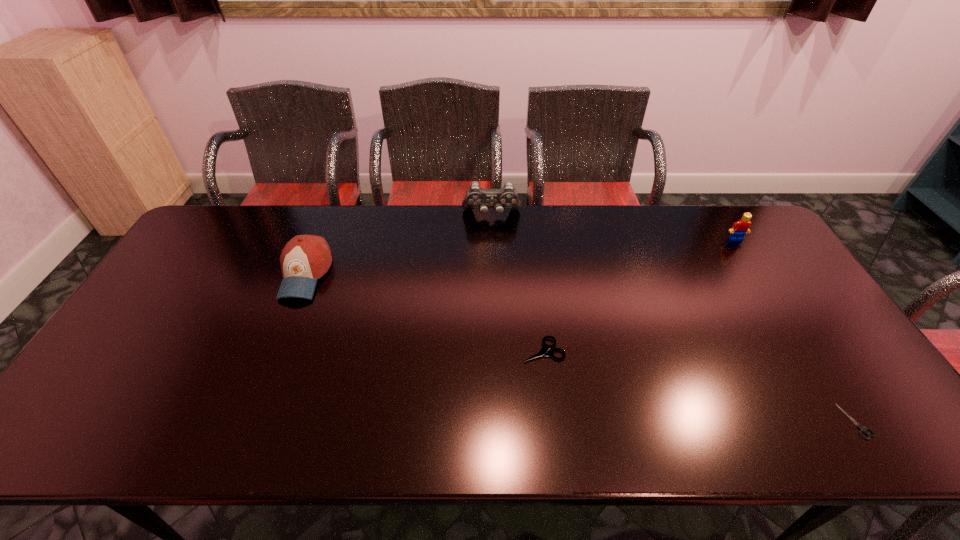
The width and height of the screenshot is (960, 540). In order to click on vacant region that satisfies the following two spatial constraints: 1. on the front-facing side of the right shears; 2. on the right side of the fourth nearest object in this screenshot , I will do `click(851, 421)`.

This screenshot has height=540, width=960. Find the location of `free region that satisfies the following two spatial constraints: 1. on the front-facing side of the baseball cap; 2. on the right side of the left shears`. free region that satisfies the following two spatial constraints: 1. on the front-facing side of the baseball cap; 2. on the right side of the left shears is located at coordinates (275, 350).

Locate an element on the screen. Image resolution: width=960 pixels, height=540 pixels. free space in the image that satisfies the following two spatial constraints: 1. on the surface of the left shears with buttons; 2. on the right side of the farthest object is located at coordinates (495, 350).

In order to click on free spot that satisfies the following two spatial constraints: 1. on the front-facing side of the nearest object; 2. on the left side of the third nearest object in this screenshot , I will do `click(247, 421)`.